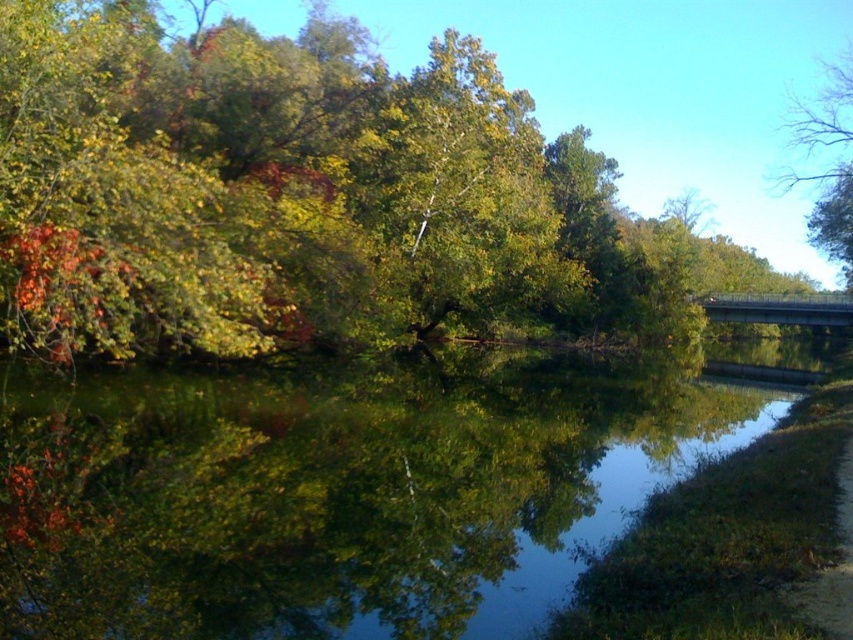
Question: Which point is farther from the camera taking this photo?

Choices:
 (A) (247, 253)
 (B) (51, 570)
 (C) (811, 124)

Answer: (C)

Question: Can you confirm if green leafy tree at upper center is positioned to the left of bare branches at upper right?

Choices:
 (A) no
 (B) yes

Answer: (B)

Question: Does green reflective water at center appear over bare branches at upper right?

Choices:
 (A) yes
 (B) no

Answer: (B)

Question: Which of the following is the farthest from the observer?

Choices:
 (A) bare branches at upper right
 (B) green leafy tree at upper center

Answer: (A)

Question: Is green reflective water at center to the right of bare branches at upper right from the viewer's perspective?

Choices:
 (A) no
 (B) yes

Answer: (A)

Question: Which object appears closest to the camera in this image?

Choices:
 (A) bare branches at upper right
 (B) green reflective water at center
 (C) green leafy tree at upper center

Answer: (B)